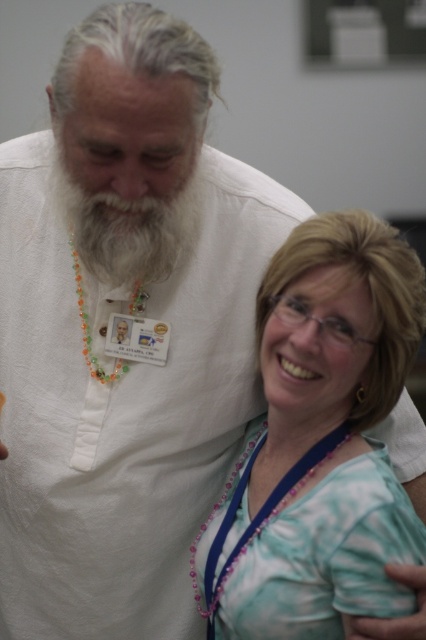
You are an observer standing in the same room as the two people. You notice a teal fabric shirt at lower right. Where exactly is the teal fabric shirt located relative to the point marked at coordinates [321,442]?

The teal fabric shirt at lower right is located exactly at the point marked at coordinates [321,442].

Consider the image. You are standing in front of the two people in the image. There are two points marked on the image, one at coordinate point (x=351, y=472) and the other at point (x=89, y=205). Which point is closer to you?

Point (x=351, y=472) is closer to the viewer than point (x=89, y=205).

You are a security guard checking badges in a building. You see the teal fabric shirt at lower right and the white soft beard at center. Which one is closer to you?

The teal fabric shirt at lower right is closer to you because it is in front of the white soft beard at center.